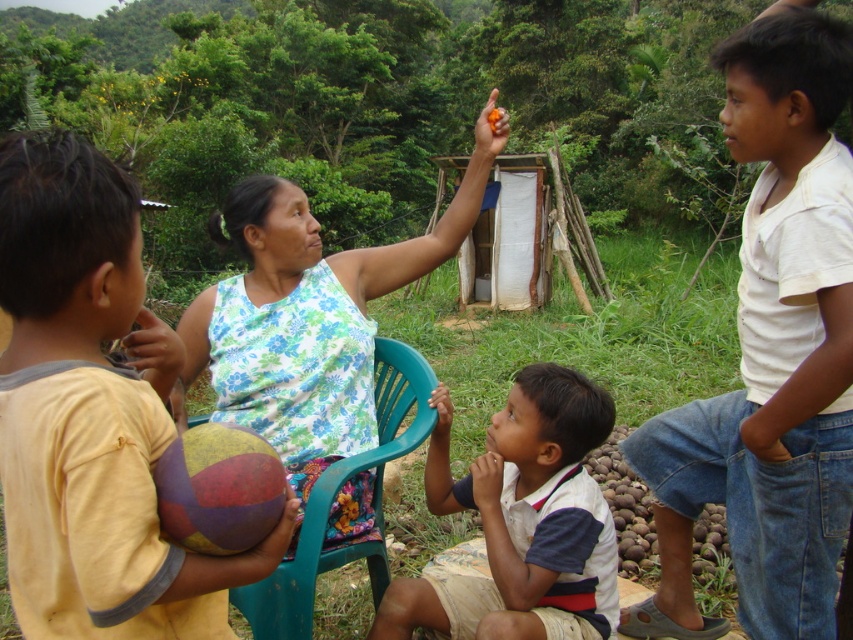
You are standing in the rural outdoor setting and want to place a small flag at the point closer to you between point (741, 620) and point (390, 422). Which point should you choose?

You should choose point (741, 620) because it is closer to the viewer than point (390, 422).

You are a photographer setting up a shot of the scene. You notice the white cotton shirt at center and the teal plastic chair at center. Which object should you focus on if you want to capture the larger one in your frame?

The teal plastic chair at center is larger than the white cotton shirt at center, so you should focus on the teal plastic chair at center to capture the larger object.